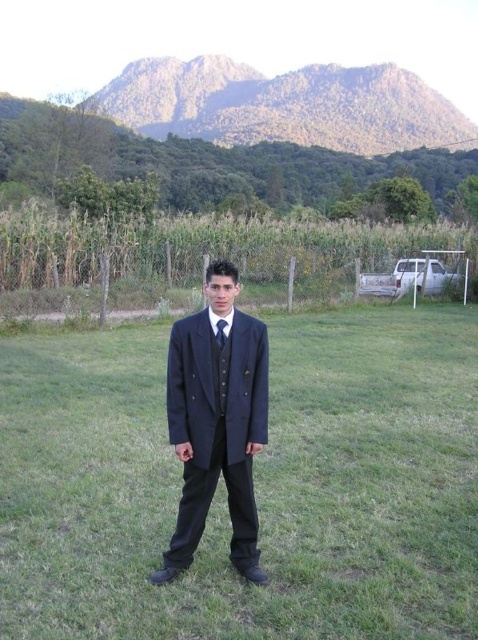
Question: Which point is closer to the camera taking this photo?

Choices:
 (A) (178, 547)
 (B) (269, 497)
 (C) (218, 339)

Answer: (C)

Question: Which object is closer to the camera taking this photo?

Choices:
 (A) dark blue silk tie at center
 (B) navy blue suit at center

Answer: (B)

Question: Is navy fabric suit at center in front of dark blue silk tie at center?

Choices:
 (A) yes
 (B) no

Answer: (A)

Question: Which object appears farthest from the camera in this image?

Choices:
 (A) dark blue silk tie at center
 (B) navy fabric suit at center

Answer: (A)

Question: Does navy fabric suit at center appear under navy blue suit at center?

Choices:
 (A) yes
 (B) no

Answer: (A)

Question: Does navy fabric suit at center have a larger size compared to navy blue suit at center?

Choices:
 (A) yes
 (B) no

Answer: (A)